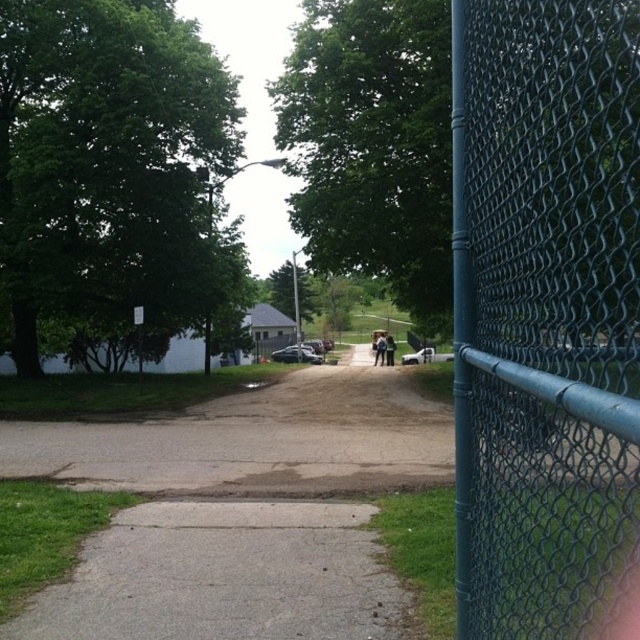
Question: Where is brown dirt track at center located in relation to light blue jeans at center in the image?

Choices:
 (A) above
 (B) below

Answer: (B)

Question: Can you confirm if teal chain-link fence at right is positioned below brown dirt track at center?

Choices:
 (A) no
 (B) yes

Answer: (A)

Question: Which point is farther to the camera?

Choices:
 (A) dark blue jeans at center
 (B) brown dirt track at center
 (C) teal chain-link fence at right
 (D) light blue jeans at center

Answer: (D)

Question: Estimate the real-world distances between objects in this image. Which object is farther from the teal chain-link fence at right?

Choices:
 (A) light blue jeans at center
 (B) dark blue jeans at center
 (C) brown dirt track at center

Answer: (A)

Question: Which point is closer to the camera?

Choices:
 (A) (385, 337)
 (B) (291, 474)
 (C) (378, 360)

Answer: (B)

Question: Can you confirm if brown dirt track at center is smaller than dark blue jeans at center?

Choices:
 (A) yes
 (B) no

Answer: (B)